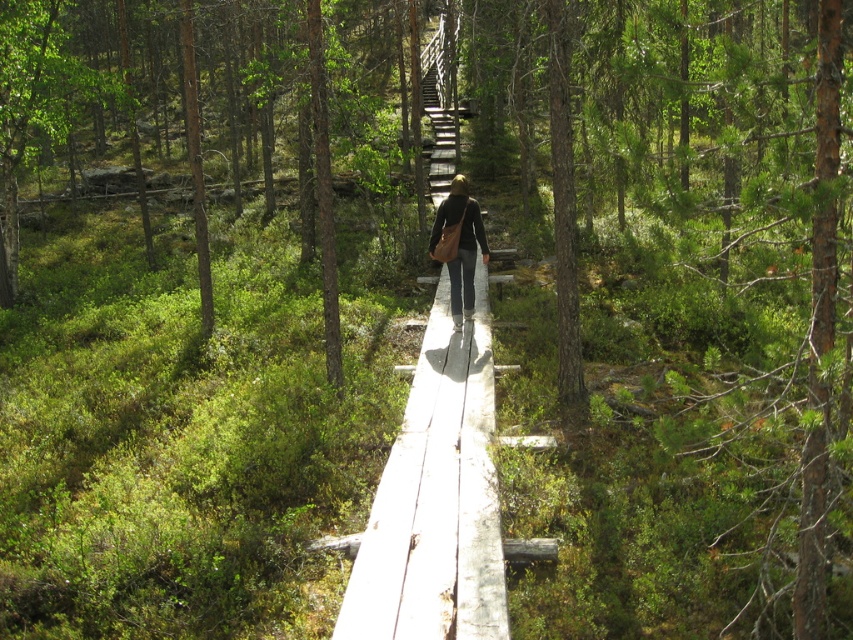
Can you confirm if wooden stairs at center is positioned below brown leather bag at center?

Incorrect, wooden stairs at center is not positioned below brown leather bag at center.

Does wooden stairs at center have a smaller size compared to brown leather bag at center?

No, wooden stairs at center is not smaller than brown leather bag at center.

This screenshot has width=853, height=640. Describe the element at coordinates (440, 102) in the screenshot. I see `wooden stairs at center` at that location.

Locate an element on the screen. This screenshot has height=640, width=853. wooden stairs at center is located at coordinates click(440, 102).

Is wooden plank at center further to the viewer compared to wooden stairs at center?

No, it is in front of wooden stairs at center.

Can you confirm if wooden plank at center is positioned to the left of wooden stairs at center?

In fact, wooden plank at center is to the right of wooden stairs at center.

Between point (467, 592) and point (434, 184), which one is positioned behind?

The point (434, 184) is behind.

The image size is (853, 640). Find the location of `wooden plank at center`. wooden plank at center is located at coordinates (437, 486).

Is wooden plank at center to the left of brown leather bag at center from the viewer's perspective?

No, wooden plank at center is not to the left of brown leather bag at center.

In the scene shown: Which of these two, wooden plank at center or brown leather bag at center, stands taller?

Standing taller between the two is brown leather bag at center.

Find the location of a particular element. wooden plank at center is located at coordinates (437, 486).

I want to click on wooden plank at center, so click(x=437, y=486).